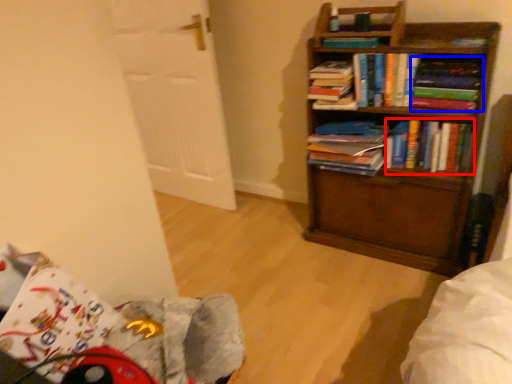
Question: Which object is closer to the camera taking this photo, book (highlighted by a red box) or paperback book (highlighted by a blue box)?

Choices:
 (A) book
 (B) paperback book

Answer: (B)